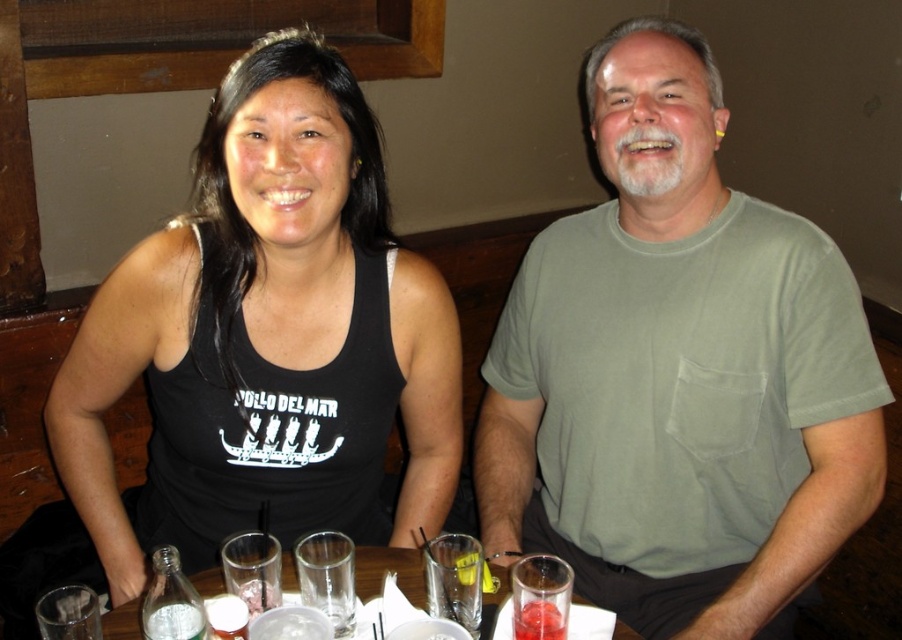
Is clear glass bottle at lower left smaller than translucent glass at lower center?

Incorrect, clear glass bottle at lower left is not smaller in size than translucent glass at lower center.

Does point (198, 609) come in front of point (546, 611)?

Yes, point (198, 609) is closer to viewer.

You are a GUI agent. You are given a task and a screenshot of the screen. Output one action in this format:
    pyautogui.click(x=<x>, y=<y>)
    Task: Click on the clear glass bottle at lower left
    This screenshot has width=902, height=640.
    Given the screenshot: What is the action you would take?
    pyautogui.click(x=175, y=621)

Between black tank top at center and yellow translucent jelly at center, which one appears on the left side from the viewer's perspective?

black tank top at center

Find the location of a particular element. The image size is (902, 640). black tank top at center is located at coordinates (267, 324).

Does green cotton t-shirt at center have a larger size compared to yellow translucent jelly at center?

Correct, green cotton t-shirt at center is larger in size than yellow translucent jelly at center.

Is green cotton t-shirt at center below yellow translucent jelly at center?

Actually, green cotton t-shirt at center is above yellow translucent jelly at center.

Is point (626, 84) positioned in front of point (474, 580)?

No, (626, 84) is further to viewer.

Identify the location of green cotton t-shirt at center. (678, 372).